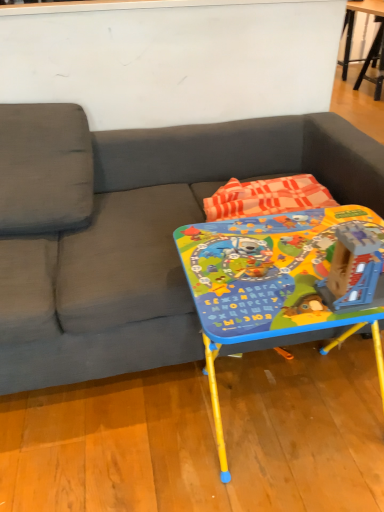
Locate an element on the screen. gray fabric couch at center is located at coordinates (152, 244).

Describe the element at coordinates (270, 283) in the screenshot. I see `matte plastic table at center, which is the second table in back-to-front order` at that location.

What do you see at coordinates (353, 26) in the screenshot?
I see `wooden table at upper right, the second table when ordered from front to back` at bounding box center [353, 26].

Where is `gray fabric couch at center`? This screenshot has width=384, height=512. gray fabric couch at center is located at coordinates (152, 244).

Considering the positions of objects wooden table at upper right, which ranks as the 2th table in left-to-right order, and matte plastic table at center, the first table in the left-to-right sequence, in the image provided, who is behind, wooden table at upper right, which ranks as the 2th table in left-to-right order, or matte plastic table at center, the first table in the left-to-right sequence,?

wooden table at upper right, which ranks as the 2th table in left-to-right order, is further away from the camera.

Which point is more distant from viewer, [381,17] or [307,239]?

Positioned behind is point [381,17].

Which of these two, wooden table at upper right, which appears as the 2th table when ordered from the bottom, or matte plastic table at center, the first table in the left-to-right sequence, is thinner?

With smaller width is wooden table at upper right, which appears as the 2th table when ordered from the bottom.

Based on the photo, could you tell me if wooden table at upper right, the 1th table from the back, is turned towards matte plastic table at center, the first table in the front-to-back sequence?

No.

Is wooden table at upper right, which ranks as the 2th table in left-to-right order, far away from gray fabric couch at center?

Yes.

Does wooden table at upper right, which appears as the 2th table when ordered from the bottom, have a larger size compared to gray fabric couch at center?

No.

Is wooden table at upper right, which appears as the 2th table when ordered from the bottom, shorter than gray fabric couch at center?

Correct, wooden table at upper right, which appears as the 2th table when ordered from the bottom, is not as tall as gray fabric couch at center.

Considering the sizes of objects matte plastic table at center, marked as the 2th table in a top-to-bottom arrangement, and wooden table at upper right, the 1th table from the back, in the image provided, who is smaller, matte plastic table at center, marked as the 2th table in a top-to-bottom arrangement, or wooden table at upper right, the 1th table from the back,?

Smaller between the two is wooden table at upper right, the 1th table from the back.

Consider the image. Which object is closer to the camera, matte plastic table at center, arranged as the first table when ordered from the bottom, or wooden table at upper right, which appears as the 2th table when ordered from the bottom?

matte plastic table at center, arranged as the first table when ordered from the bottom.

From the picture: From a real-world perspective, is matte plastic table at center, the first table in the left-to-right sequence, positioned over wooden table at upper right, marked as the first table in a top-to-bottom arrangement, based on gravity?

No.

Image resolution: width=384 pixels, height=512 pixels. I want to click on studio couch above the plastic blue building at center (from the image's perspective), so click(x=152, y=244).

Would you say gray fabric couch at center contains plastic blue building at center?

That's incorrect, plastic blue building at center is not inside gray fabric couch at center.

Based on the photo, would you say gray fabric couch at center is a long distance from plastic blue building at center?

No, gray fabric couch at center is not far from plastic blue building at center.

Is matte plastic table at center, the first table in the left-to-right sequence, taller than plastic blue building at center?

Yes, matte plastic table at center, the first table in the left-to-right sequence, is taller than plastic blue building at center.

Is matte plastic table at center, the first table in the front-to-back sequence, facing away from plastic blue building at center?

matte plastic table at center, the first table in the front-to-back sequence, does not have its back to plastic blue building at center.

Does matte plastic table at center, the first table in the left-to-right sequence, have a greater width compared to plastic blue building at center?

Indeed, matte plastic table at center, the first table in the left-to-right sequence, has a greater width compared to plastic blue building at center.

How different are the orientations of matte plastic table at center, which is the second table in back-to-front order, and plastic blue building at center in degrees?

0.00299 degrees separate the facing orientations of matte plastic table at center, which is the second table in back-to-front order, and plastic blue building at center.

Consider the image. Is plastic blue building at center at the back of wooden table at upper right, placed as the first table when sorted from right to left?

wooden table at upper right, placed as the first table when sorted from right to left, is not turned away from plastic blue building at center.

Locate an element on the screen. The height and width of the screenshot is (512, 384). table lying on the right of plastic blue building at center is located at coordinates (353, 26).

Is wooden table at upper right, which appears as the 2th table when ordered from the bottom, taller than plastic blue building at center?

Correct, wooden table at upper right, which appears as the 2th table when ordered from the bottom, is much taller as plastic blue building at center.

Between wooden table at upper right, the second table when ordered from front to back, and plastic blue building at center, which one is positioned in front?

plastic blue building at center is closer to the camera.

Can we say plastic blue building at center lies outside matte plastic table at center, marked as the 2th table in a top-to-bottom arrangement?

Yes, plastic blue building at center is outside of matte plastic table at center, marked as the 2th table in a top-to-bottom arrangement.

Is plastic blue building at center positioned behind matte plastic table at center, the first table in the left-to-right sequence?

No, it is not.

How distant is plastic blue building at center from matte plastic table at center, marked as the 2th table in a top-to-bottom arrangement?

plastic blue building at center is 5.38 inches from matte plastic table at center, marked as the 2th table in a top-to-bottom arrangement.

The image size is (384, 512). What are the coordinates of `table below the wooden table at upper right, the second table when ordered from front to back (from the image's perspective)` in the screenshot? It's located at (270, 283).

What are the coordinates of `the 2nd table behind the gray fabric couch at center, starting your count from the anchor` in the screenshot? It's located at (353, 26).

When comparing their distances from plastic blue building at center, does matte plastic table at center, which ranks as the 2th table in right-to-left order, or gray fabric couch at center seem further?

The object further to plastic blue building at center is gray fabric couch at center.

Looking at the image, which one is located further to plastic blue building at center, wooden table at upper right, which appears as the 2th table when ordered from the bottom, or gray fabric couch at center?

Among the two, wooden table at upper right, which appears as the 2th table when ordered from the bottom, is located further to plastic blue building at center.

Consider the image. Looking at the image, which one is located closer to gray fabric couch at center, plastic blue building at center or wooden table at upper right, the 1th table from the back?

Based on the image, plastic blue building at center appears to be nearer to gray fabric couch at center.

Which object lies nearer to the anchor point matte plastic table at center, which is the second table in back-to-front order, plastic blue building at center or gray fabric couch at center?

The object closer to matte plastic table at center, which is the second table in back-to-front order, is plastic blue building at center.

In the scene shown: Which object lies nearer to the anchor point gray fabric couch at center, matte plastic table at center, which is the second table in back-to-front order, or wooden table at upper right, the second table when ordered from front to back?

matte plastic table at center, which is the second table in back-to-front order, lies closer to gray fabric couch at center than the other object.

Which object lies nearer to the anchor point wooden table at upper right, the 1th table from the back, plastic blue building at center or gray fabric couch at center?

Based on the image, gray fabric couch at center appears to be nearer to wooden table at upper right, the 1th table from the back.

Based on their spatial positions, is plastic blue building at center or wooden table at upper right, placed as the first table when sorted from right to left, further from matte plastic table at center, marked as the 2th table in a top-to-bottom arrangement?

wooden table at upper right, placed as the first table when sorted from right to left.

Looking at the image, which one is located closer to plastic blue building at center, gray fabric couch at center or matte plastic table at center, which ranks as the 2th table in right-to-left order?

Among the two, matte plastic table at center, which ranks as the 2th table in right-to-left order, is located nearer to plastic blue building at center.

This screenshot has width=384, height=512. Find the location of `table between gray fabric couch at center and wooden table at upper right, which ranks as the 2th table in left-to-right order, from front to back`. table between gray fabric couch at center and wooden table at upper right, which ranks as the 2th table in left-to-right order, from front to back is located at coordinates (270, 283).

Where is `studio couch located between plastic blue building at center and wooden table at upper right, which ranks as the 2th table in left-to-right order, in the depth direction`? studio couch located between plastic blue building at center and wooden table at upper right, which ranks as the 2th table in left-to-right order, in the depth direction is located at coordinates 152,244.

I want to click on table between plastic blue building at center and wooden table at upper right, which appears as the 2th table when ordered from the bottom, in the front-back direction, so click(270, 283).

This screenshot has width=384, height=512. In order to click on table between gray fabric couch at center and plastic blue building at center from left to right in this screenshot , I will do `click(270, 283)`.